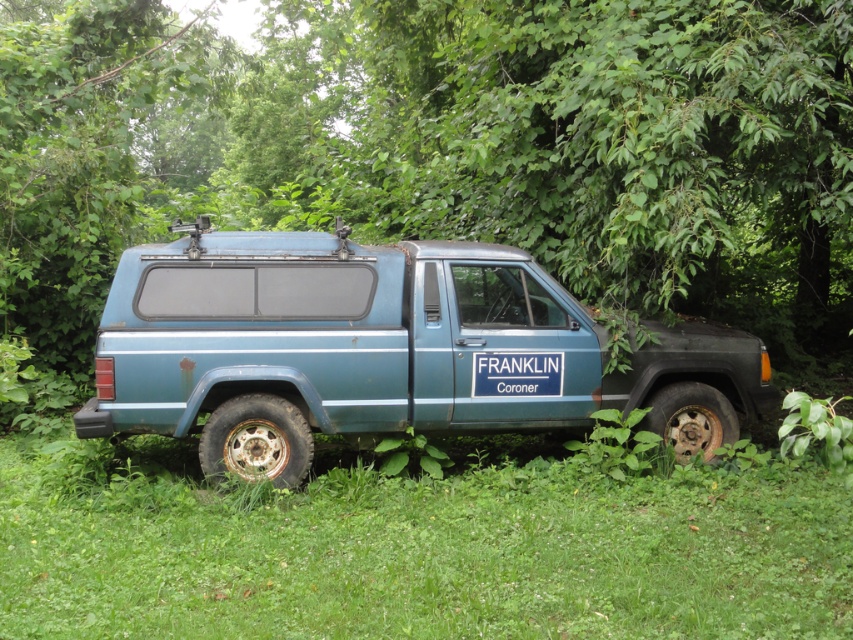
You are a delivery person trying to park your vehicle in the area where the image is taken. You need to know if there is enough space between the green grassy at lower center and the rusty teal van at center to fit your truck, which is 2 meters wide. Can you determine this based on the information provided?

The green grassy at lower center is wider than the rusty teal van at center, but the exact width of the space between them is not specified. Therefore, it is unclear if there is enough space to fit a 2 meter wide truck.

You are a mechanic trying to access the rusty metal tire at lower left to inspect it. The rusty teal van at center is blocking your path. Can you safely move around the van to reach the tire without damaging either the van or the tire?

The rusty teal van at center and rusty metal tire at lower left are 24.20 inches apart from each other. This distance is too narrow to safely maneuver around the van without risking damage to both the van and the tire. You should consider alternative routes or methods to access the tire.

You are standing in front of the blue Jeep Cherokee parked in the grassy area surrounded by dense green foliage. You notice two points marked on the Jeep. The first point is at coordinates point (10,586) and the second is at point (689,422). Which of these two points is closer to you?

Point (10,586) is closer to the viewer than point (689,422).